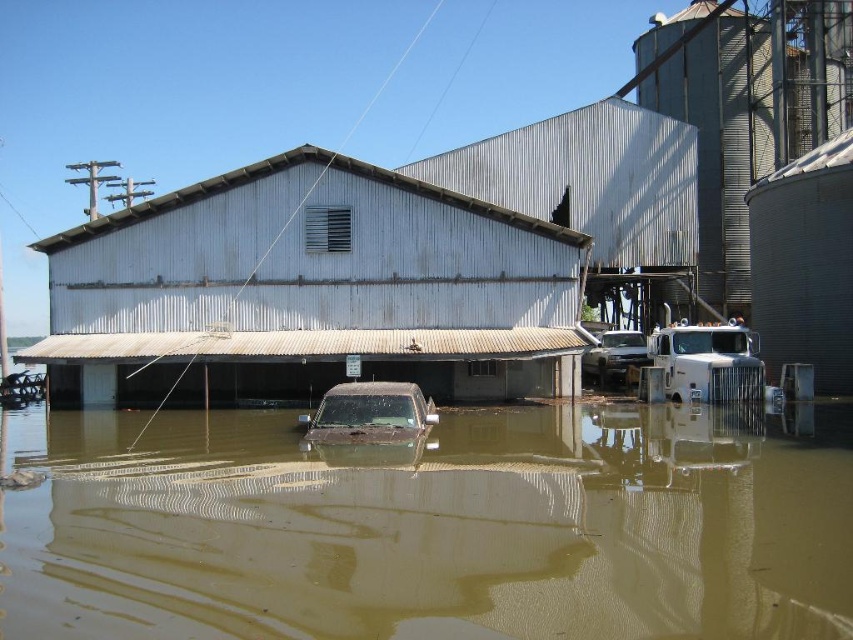
Question: Estimate the real-world distances between objects in this image. Which object is closer to the dirty matte truck at center?

Choices:
 (A) brushed metal silo at upper right
 (B) brown muddy water at center

Answer: (A)

Question: Does brown muddy water at center appear on the left side of white corrugated metal barn at center?

Choices:
 (A) no
 (B) yes

Answer: (A)

Question: Is brushed metal silo at upper right below muddy brown truck at center?

Choices:
 (A) no
 (B) yes

Answer: (A)

Question: Which of the following is the closest to the observer?

Choices:
 (A) white corrugated metal barn at center
 (B) dirty matte truck at center
 (C) brown muddy water at center
 (D) muddy brown truck at center

Answer: (C)

Question: Which object is the closest to the muddy brown truck at center?

Choices:
 (A) dirty matte truck at center
 (B) white corrugated metal barn at center
 (C) brushed metal silo at upper right
 (D) brown muddy water at center

Answer: (D)

Question: Does brown muddy water at center have a larger size compared to dirty matte truck at center?

Choices:
 (A) no
 (B) yes

Answer: (B)